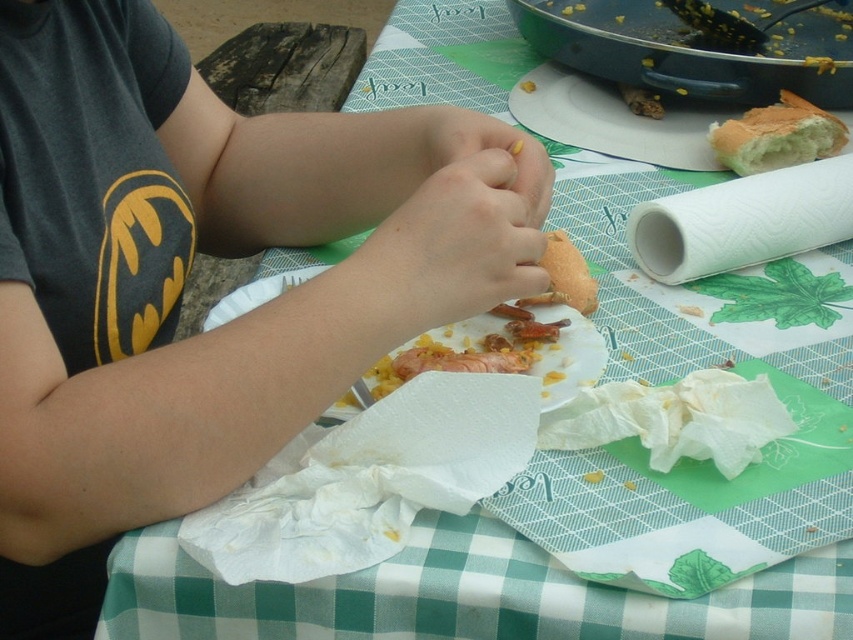
Question: Is white paper plate at center to the left of bread at upper right from the viewer's perspective?

Choices:
 (A) no
 (B) yes

Answer: (B)

Question: Observing the image, what is the correct spatial positioning of white paper at right in reference to bread at upper right?

Choices:
 (A) below
 (B) above

Answer: (A)

Question: Among these points, which one is farthest from the camera?

Choices:
 (A) (730, 140)
 (B) (569, 259)
 (C) (439, 333)
 (D) (704, 209)

Answer: (A)

Question: Which of the following is the closest to the observer?

Choices:
 (A) white paper at right
 (B) white paper plate at upper right
 (C) orange matte bread at center

Answer: (C)

Question: Which object is farther from the camera taking this photo?

Choices:
 (A) orange matte bread at center
 (B) matte black shirt at upper left

Answer: (A)

Question: Is matte black shirt at upper left positioned behind white paper plate at upper right?

Choices:
 (A) yes
 (B) no

Answer: (B)